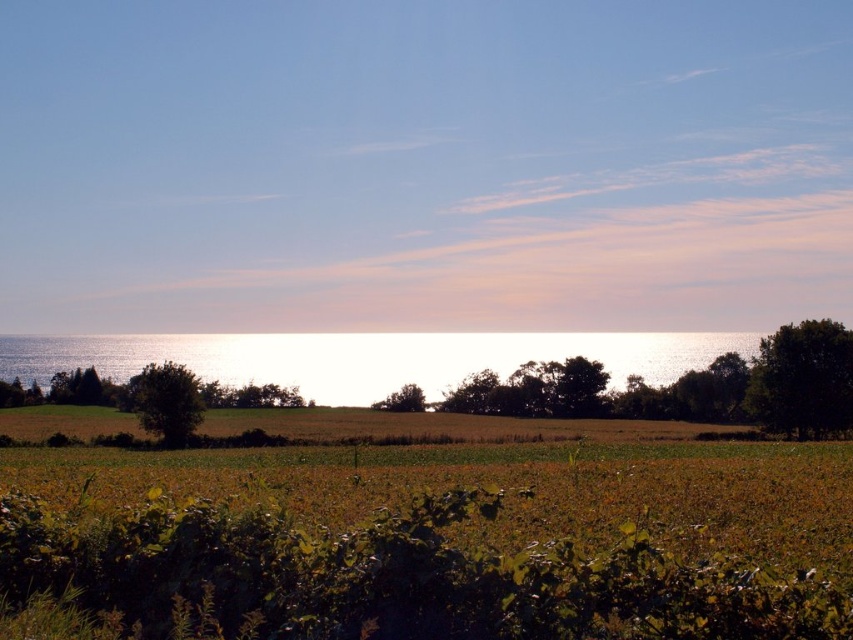
You are standing in the open field and want to reach the glistening silver water at center. Which direction should you walk relative to the green leafy tree at left?

You should walk towards the center from the green leafy tree at left, as the glistening silver water at center is located above it.

You are standing in the middle of the open field and see both the green leafy tree at right and the green leafy tree at left. Which tree is closer to you?

The green leafy tree at right is closer to you because the green leafy tree at left is behind it.

You are standing in the middle of the open field and see two points in the scene. The first point is at coordinates point (558, 342) and the second is at point (178, 403). Which point is closer to you?

Point (178, 403) is closer to you because it is less further to the viewer than point (558, 342).